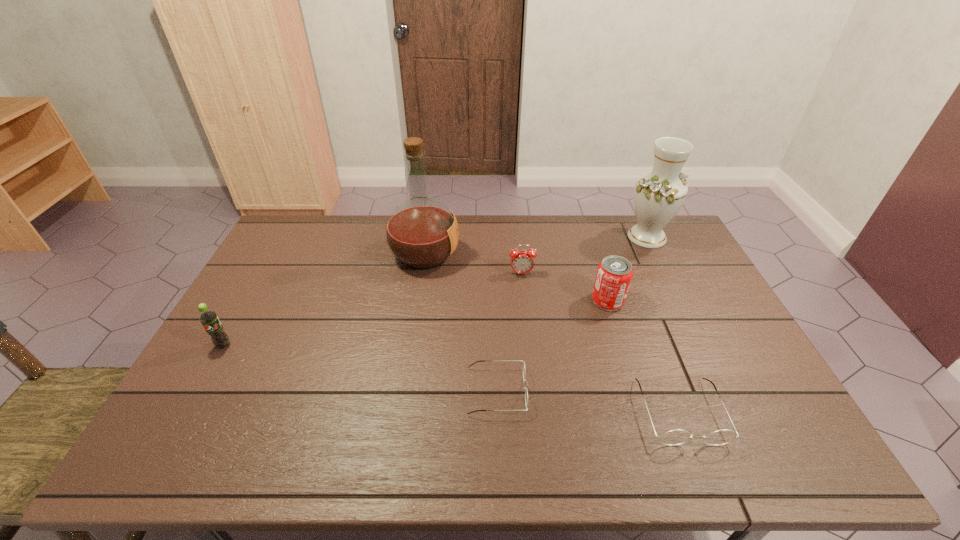
Image resolution: width=960 pixels, height=540 pixels. Identify the location of the left spectacles. [x=526, y=391].

Where is `the shorter spectacles`? This screenshot has width=960, height=540. the shorter spectacles is located at coordinates (526, 391).

I want to click on the right spectacles, so click(676, 437).

You are a GUI agent. You are given a task and a screenshot of the screen. Output one action in this format:
    pyautogui.click(x=<x>, y=<y>)
    Task: Click on the second shortest object
    
    Given the screenshot: What is the action you would take?
    pyautogui.click(x=676, y=437)

The image size is (960, 540). Identify the location of the sixth shortest object. (658, 196).

You are a GUI agent. You are given a task and a screenshot of the screen. Output one action in this format:
    pyautogui.click(x=<x>, y=<y>)
    Task: Click on the fifth tallest object
    The height and width of the screenshot is (540, 960).
    Given the screenshot: What is the action you would take?
    pyautogui.click(x=522, y=261)

This screenshot has width=960, height=540. I want to click on liquor, so click(422, 233).

Identify the location of can. (614, 274).

Find the location of `the leftmost object`. the leftmost object is located at coordinates (209, 319).

This screenshot has width=960, height=540. I want to click on soda, so click(209, 319).